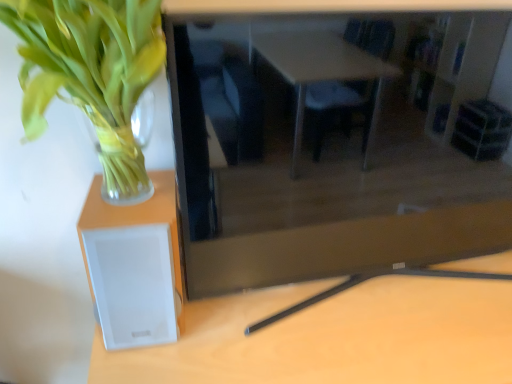
Question: Considering the relative sizes of green leafy plant at left and white matte speaker at left in the image provided, is green leafy plant at left bigger than white matte speaker at left?

Choices:
 (A) no
 (B) yes

Answer: (B)

Question: Could you tell me if green leafy plant at left is facing white matte speaker at left?

Choices:
 (A) no
 (B) yes

Answer: (A)

Question: From the image's perspective, is green leafy plant at left above white matte speaker at left?

Choices:
 (A) no
 (B) yes

Answer: (B)

Question: Is green leafy plant at left directly adjacent to white matte speaker at left?

Choices:
 (A) yes
 (B) no

Answer: (B)

Question: Is the position of green leafy plant at left more distant than that of white matte speaker at left?

Choices:
 (A) yes
 (B) no

Answer: (B)

Question: Considering the positions of matte black tv at center and green leafy plant at left in the image, is matte black tv at center wider or thinner than green leafy plant at left?

Choices:
 (A) wide
 (B) thin

Answer: (B)

Question: In terms of height, does matte black tv at center look taller or shorter compared to green leafy plant at left?

Choices:
 (A) short
 (B) tall

Answer: (B)

Question: In the image, is matte black tv at center on the left side or the right side of green leafy plant at left?

Choices:
 (A) right
 (B) left

Answer: (A)

Question: Does point (434, 150) appear closer or farther from the camera than point (52, 46)?

Choices:
 (A) farther
 (B) closer

Answer: (A)

Question: Is green leafy plant at left taller or shorter than white plastic speaker at lower left?

Choices:
 (A) short
 (B) tall

Answer: (A)

Question: Is green leafy plant at left wider or thinner than white plastic speaker at lower left?

Choices:
 (A) thin
 (B) wide

Answer: (A)

Question: From the image's perspective, relative to white plastic speaker at lower left, is green leafy plant at left above or below?

Choices:
 (A) above
 (B) below

Answer: (A)

Question: From a real-world perspective, is green leafy plant at left positioned above or below white plastic speaker at lower left?

Choices:
 (A) below
 (B) above

Answer: (B)

Question: From the image's perspective, relative to white matte speaker at left, is white plastic speaker at lower left above or below?

Choices:
 (A) below
 (B) above

Answer: (A)

Question: Looking at their shapes, would you say white plastic speaker at lower left is wider or thinner than white matte speaker at left?

Choices:
 (A) wide
 (B) thin

Answer: (A)